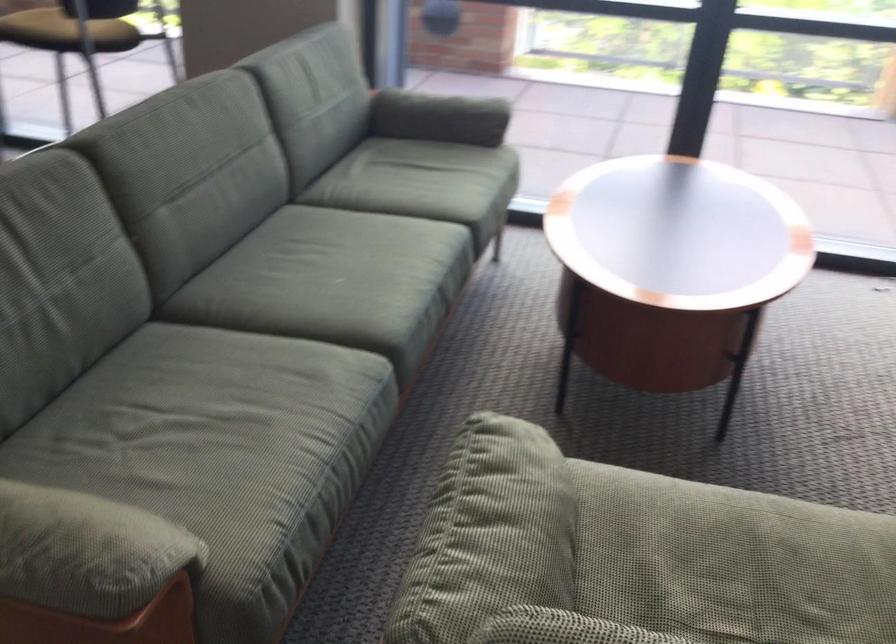
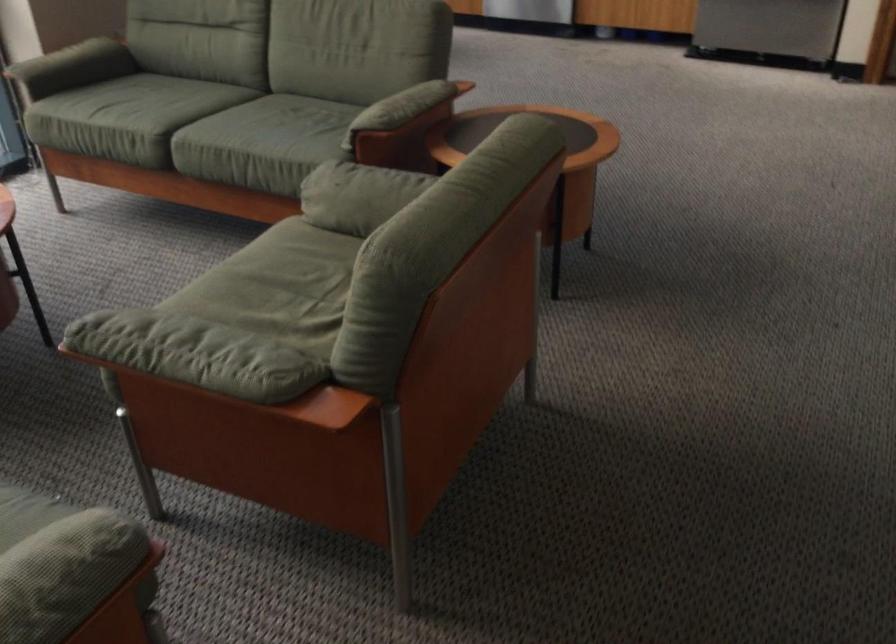
In the second image, find the point that corresponds to pixel 71 547 in the first image.

(71, 559)